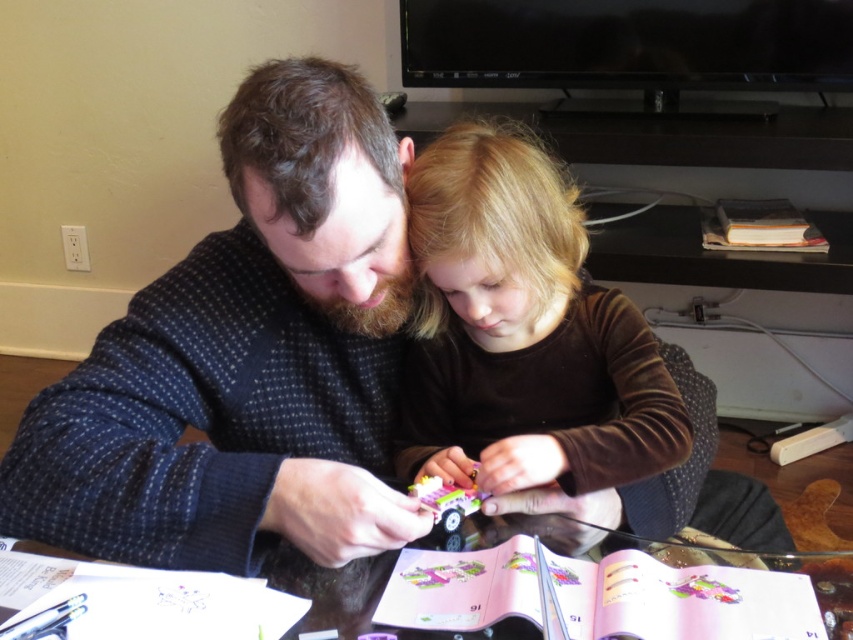
Question: Based on their relative distances, which object is farther from the brown velvet shirt at center?

Choices:
 (A) transparent glass table at center
 (B) hardcover book at upper right

Answer: (B)

Question: Which of the following is the farthest from the observer?

Choices:
 (A) brown velvet shirt at center
 (B) transparent glass table at center
 (C) hardcover book at upper right
 (D) dark blue textured sweater at center

Answer: (C)

Question: Which object is closer to the camera taking this photo?

Choices:
 (A) hardcover book at upper right
 (B) transparent glass table at center
 (C) dark blue textured sweater at center
 (D) brown velvet shirt at center

Answer: (B)

Question: Is transparent glass table at center smaller than hardcover book at upper right?

Choices:
 (A) no
 (B) yes

Answer: (B)

Question: Is dark blue textured sweater at center smaller than transparent glass table at center?

Choices:
 (A) no
 (B) yes

Answer: (A)

Question: Does dark blue textured sweater at center have a smaller size compared to brown velvet shirt at center?

Choices:
 (A) yes
 (B) no

Answer: (B)